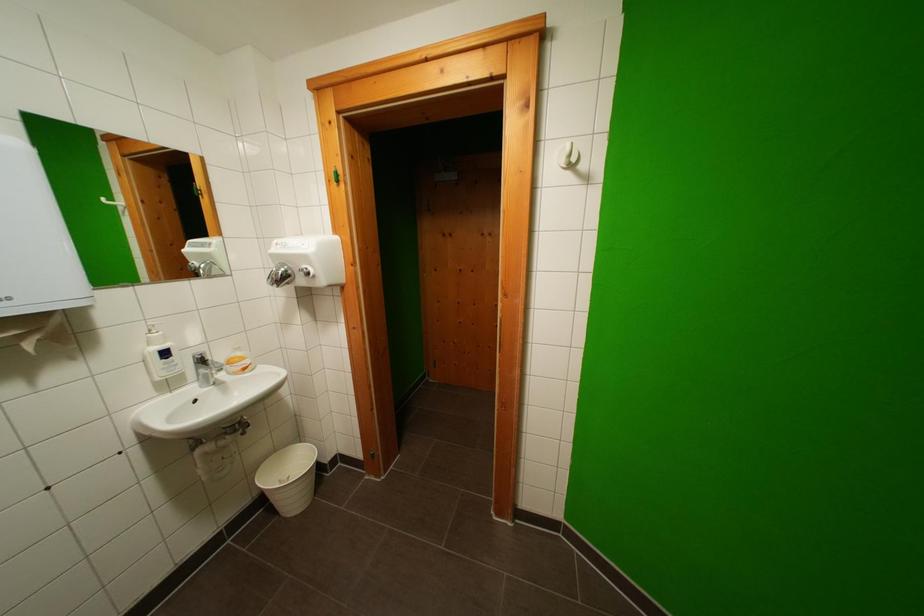
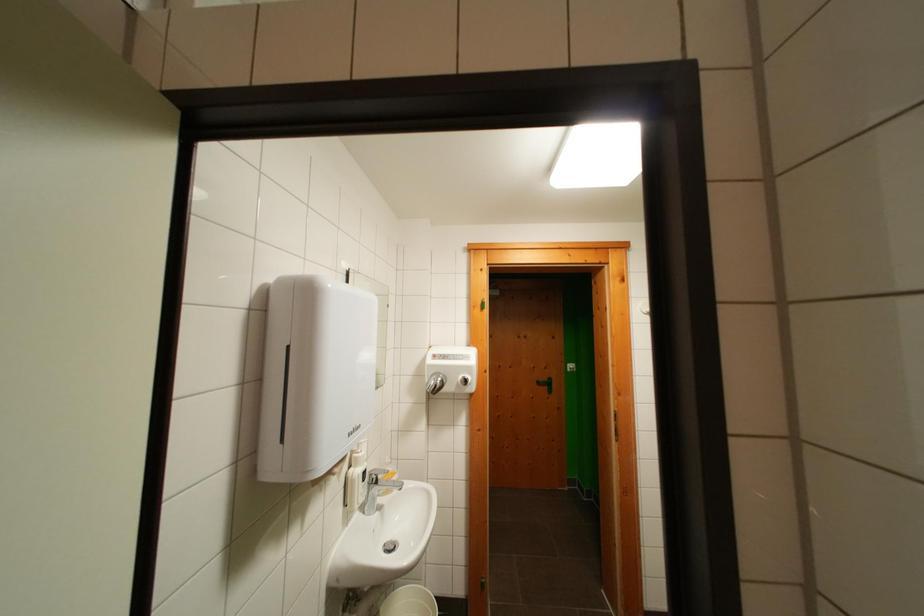
Question: What movement of the cameraman would produce the second image?

Choices:
 (A) Left
 (B) Right
 (C) Forward
 (D) Backward

Answer: (A)